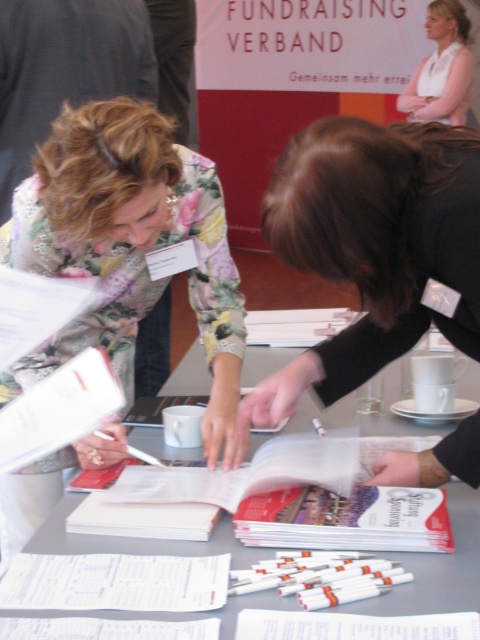
What are the coordinates of the gray paper at center in the image?

The gray paper at center is located at coordinates point (x=440, y=566).

You are an event photographer at the fundraising event. You need to capture a photo of the floral fabric dress at center and the gray paper at center. From the perspective of someone facing the scene, which object is positioned to the right?

The gray paper at center is positioned to the right of the floral fabric dress at center.

You are standing at the back of the room and want to take a photo of the point at coordinates point (39, 552). Your camera has a focal length of 50mm and you need to ensure that the point is in focus. What is the minimum distance you should be from the point to capture it clearly?

The point (39, 552) is 38.10 inches away from the viewer. To capture it clearly with a 50mm focal length, you should ensure you are at least 38.10 inches away from the point.